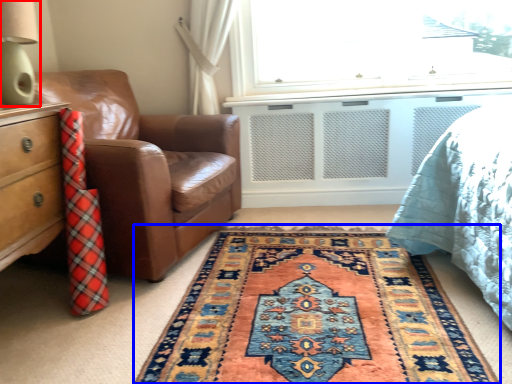
Question: Which object appears closest to the camera in this image, table lamp (highlighted by a red box) or mat (highlighted by a blue box)?

Choices:
 (A) table lamp
 (B) mat

Answer: (B)